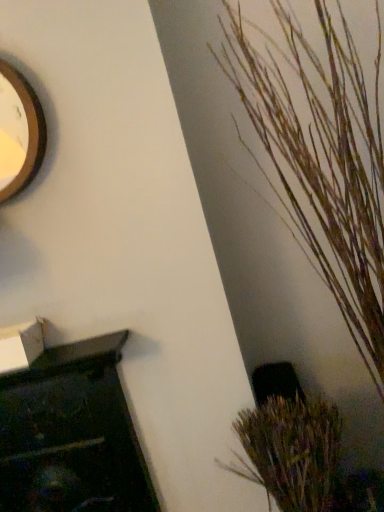
Question: Considering the relative sizes of wooden textured plant at right, acting as the first houseplant starting from the top, and brown textured plant at lower right, the first houseplant from the bottom, in the image provided, is wooden textured plant at right, acting as the first houseplant starting from the top, shorter than brown textured plant at lower right, the first houseplant from the bottom,?

Choices:
 (A) yes
 (B) no

Answer: (B)

Question: Is wooden textured plant at right, acting as the first houseplant starting from the top, not inside brown textured plant at lower right, the first houseplant from the bottom?

Choices:
 (A) no
 (B) yes

Answer: (B)

Question: Is brown textured plant at lower right, the first houseplant from the bottom, surrounded by wooden textured plant at right, which ranks as the 2th houseplant in bottom-to-top order?

Choices:
 (A) yes
 (B) no

Answer: (A)

Question: Is wooden textured plant at right, acting as the first houseplant starting from the top, aimed at brown textured plant at lower right, which appears as the 2th houseplant when viewed from the top?

Choices:
 (A) no
 (B) yes

Answer: (A)

Question: From a real-world perspective, is wooden textured plant at right, which ranks as the 2th houseplant in bottom-to-top order, below brown textured plant at lower right, which appears as the 2th houseplant when viewed from the top?

Choices:
 (A) yes
 (B) no

Answer: (B)

Question: Considering the relative positions of wooden textured plant at right, which ranks as the 2th houseplant in bottom-to-top order, and brown textured plant at lower right, the first houseplant from the bottom, in the image provided, is wooden textured plant at right, which ranks as the 2th houseplant in bottom-to-top order, to the right of brown textured plant at lower right, the first houseplant from the bottom, from the viewer's perspective?

Choices:
 (A) no
 (B) yes

Answer: (B)

Question: Could you tell me if wooden clock at upper left is turned towards brown textured plant at lower right, which appears as the 2th houseplant when viewed from the top?

Choices:
 (A) no
 (B) yes

Answer: (A)

Question: Is wooden clock at upper left smaller than brown textured plant at lower right, the first houseplant from the bottom?

Choices:
 (A) yes
 (B) no

Answer: (A)

Question: Is wooden clock at upper left looking in the opposite direction of brown textured plant at lower right, the first houseplant from the bottom?

Choices:
 (A) no
 (B) yes

Answer: (A)

Question: Can you confirm if wooden clock at upper left is shorter than brown textured plant at lower right, the first houseplant from the bottom?

Choices:
 (A) no
 (B) yes

Answer: (B)

Question: Does wooden clock at upper left come behind brown textured plant at lower right, the first houseplant from the bottom?

Choices:
 (A) yes
 (B) no

Answer: (A)

Question: From a real-world perspective, is wooden clock at upper left positioned over brown textured plant at lower right, the first houseplant from the bottom, based on gravity?

Choices:
 (A) yes
 (B) no

Answer: (A)

Question: From the image's perspective, would you say brown textured plant at lower right, which appears as the 2th houseplant when viewed from the top, is positioned over wooden clock at upper left?

Choices:
 (A) no
 (B) yes

Answer: (A)